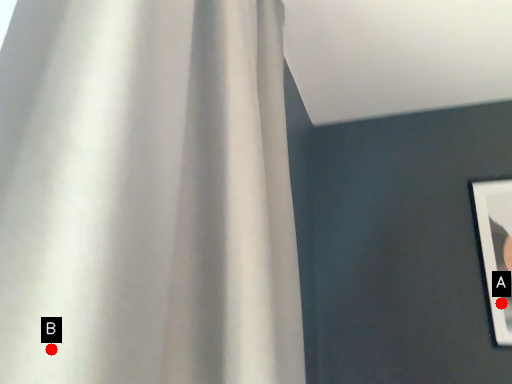
Question: Two points are circled on the image, labeled by A and B beside each circle. Which point appears farthest from the camera in this image?

Choices:
 (A) A is further
 (B) B is further

Answer: (A)